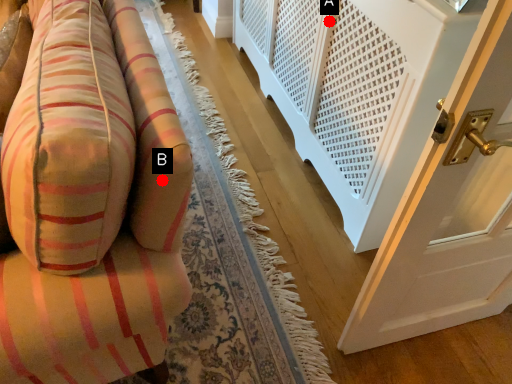
Question: Two points are circled on the image, labeled by A and B beside each circle. Which point appears farthest from the camera in this image?

Choices:
 (A) A is further
 (B) B is further

Answer: (A)